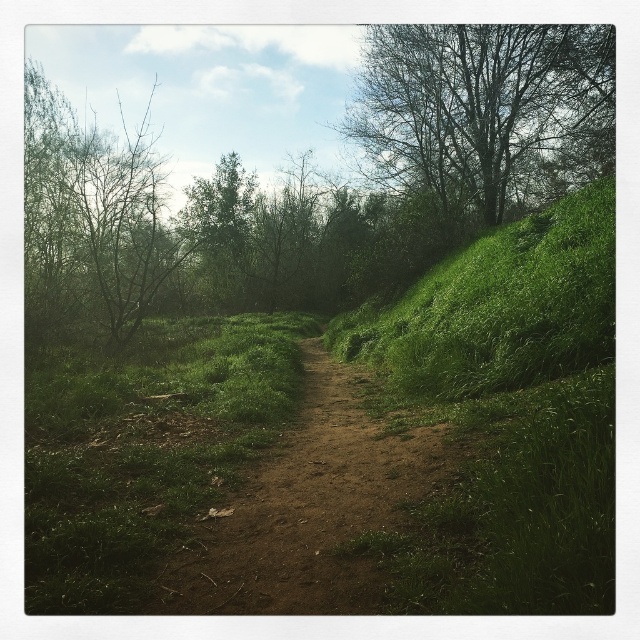
You are a hiker standing on the dirt path and want to determine which tree is taller between the green leafy tree at upper right and the bare branches at left. Which one is taller?

The green leafy tree at upper right has a lesser height compared to the bare branches at left, so the bare branches at left are taller.

You are a hiker planning to take a photo of the green leafy tree at upper right and the green leafy tree at upper center from the dirt path. Which tree will appear taller in the photo?

The green leafy tree at upper center will appear taller in the photo because it is taller than the green leafy tree at upper right.